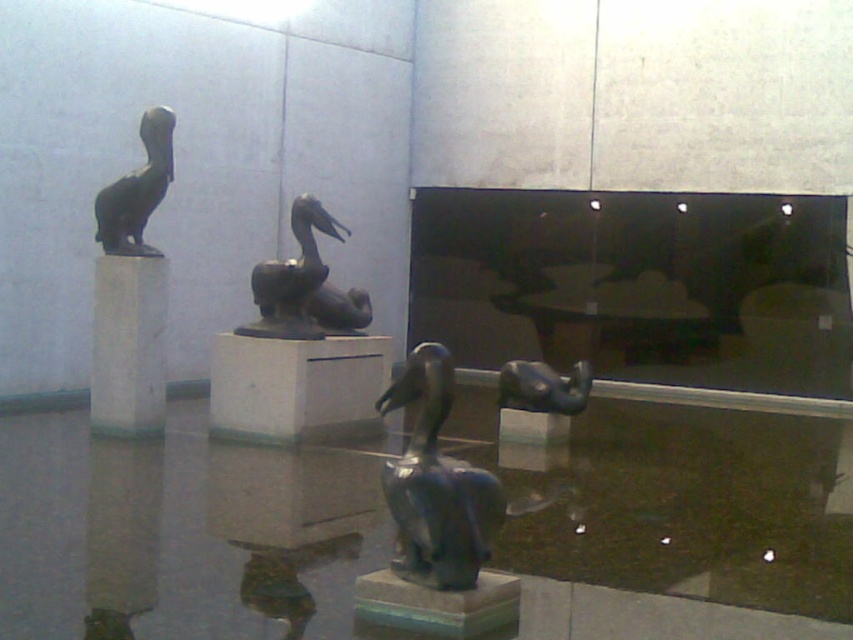
Is white marble pillar at left wider than bronze statue of a bird at upper left?

Incorrect, white marble pillar at left's width does not surpass bronze statue of a bird at upper left's.

Which is below, white marble pillar at left or bronze statue of a bird at upper left?

white marble pillar at left is below.

Between point (131, 360) and point (161, 145), which one is positioned behind?

The point (131, 360) is behind.

Where is `white marble pillar at left`? The image size is (853, 640). white marble pillar at left is located at coordinates (128, 344).

Image resolution: width=853 pixels, height=640 pixels. In order to click on white marble pedestal at center in this screenshot , I will do `click(297, 387)`.

The image size is (853, 640). Identify the location of shiny bronze pelican at center. (436, 484).

You are a GUI agent. You are given a task and a screenshot of the screen. Output one action in this format:
    pyautogui.click(x=<x>, y=<y>)
    Task: Click on the shiny bronze pelican at center
    
    Given the screenshot: What is the action you would take?
    pyautogui.click(x=436, y=484)